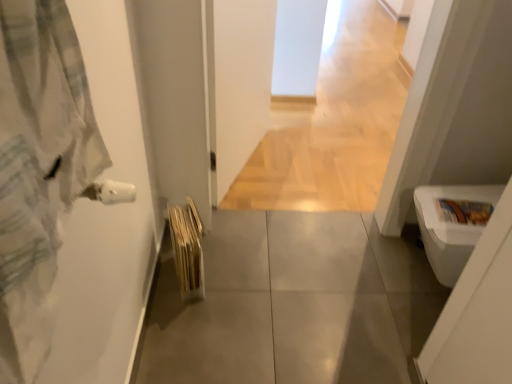
Image resolution: width=512 pixels, height=384 pixels. What do you see at coordinates (451, 226) in the screenshot?
I see `white glossy toilet bowl at lower right` at bounding box center [451, 226].

This screenshot has height=384, width=512. In order to click on light gray flannel bathrobe at left in this screenshot , I will do `click(38, 169)`.

Who is taller, light gray flannel bathrobe at left or white glossy toilet bowl at lower right?

With more height is white glossy toilet bowl at lower right.

How much distance is there between light gray flannel bathrobe at left and white glossy toilet bowl at lower right?

light gray flannel bathrobe at left and white glossy toilet bowl at lower right are 4.13 feet apart.

Between light gray flannel bathrobe at left and white glossy toilet bowl at lower right, which one has smaller width?

Thinner between the two is light gray flannel bathrobe at left.

From a real-world perspective, which is physically above, light gray flannel bathrobe at left or white glossy toilet bowl at lower right?

In real-world perspective, light gray flannel bathrobe at left is above.

Is light gray flannel bathrobe at left looking in the opposite direction of gray tile floor at center?

That's not correct — light gray flannel bathrobe at left is not looking away from gray tile floor at center.

Considering their positions, is light gray flannel bathrobe at left located in front of or behind gray tile floor at center?

Clearly, light gray flannel bathrobe at left is in front of gray tile floor at center.

Considering the positions of objects light gray flannel bathrobe at left and gray tile floor at center in the image provided, who is more to the right, light gray flannel bathrobe at left or gray tile floor at center?

gray tile floor at center is more to the right.

In the scene shown: From the image's perspective, is light gray flannel bathrobe at left positioned above or below gray tile floor at center?

light gray flannel bathrobe at left is situated higher than gray tile floor at center in the image.

Is light gray flannel bathrobe at left far from light wood floor at center?

Yes, light gray flannel bathrobe at left and light wood floor at center are located far from each other.

From a real-world perspective, which is physically above, light gray flannel bathrobe at left or light wood floor at center?

light gray flannel bathrobe at left, from a real-world perspective.

In order to click on bathrobe located in front of the light wood floor at center in this screenshot , I will do `click(38, 169)`.

From the image's perspective, which one is positioned lower, white glossy toilet bowl at lower right or gray tile floor at center?

gray tile floor at center, from the image's perspective.

Who is smaller, white glossy toilet bowl at lower right or gray tile floor at center?

gray tile floor at center.

Is the position of white glossy toilet bowl at lower right more distant than that of gray tile floor at center?

No, white glossy toilet bowl at lower right is in front of gray tile floor at center.

Is light gray flannel bathrobe at left looking in the opposite direction of beige textured bath towel at lower left?

light gray flannel bathrobe at left does not have its back to beige textured bath towel at lower left.

From a real-world perspective, which object rests below the other?

From a 3D spatial view, beige textured bath towel at lower left is below.

Would you say light gray flannel bathrobe at left is outside beige textured bath towel at lower left?

light gray flannel bathrobe at left lies outside beige textured bath towel at lower left's area.

In the image, is beige textured bath towel at lower left positioned in front of or behind white glossy toilet bowl at lower right?

beige textured bath towel at lower left is behind white glossy toilet bowl at lower right.

Is beige textured bath towel at lower left aimed at white glossy toilet bowl at lower right?

Yes, beige textured bath towel at lower left is facing white glossy toilet bowl at lower right.

Which is behind, point (170, 231) or point (434, 201)?

The point (170, 231) is behind.

Looking at this image, is white glossy toilet bowl at lower right a part of beige textured bath towel at lower left?

No, white glossy toilet bowl at lower right is not surrounded by beige textured bath towel at lower left.

Based on the photo, is light wood floor at center taller than beige textured bath towel at lower left?

Incorrect, the height of light wood floor at center is not larger of that of beige textured bath towel at lower left.

From a real-world perspective, between light wood floor at center and beige textured bath towel at lower left, who is vertically higher?

From a 3D spatial view, beige textured bath towel at lower left is above.

Which is behind, light wood floor at center or beige textured bath towel at lower left?

Positioned behind is light wood floor at center.

From the picture: Does light wood floor at center turn towards beige textured bath towel at lower left?

No, light wood floor at center does not turn towards beige textured bath towel at lower left.

Find the location of a particular element. The image size is (512, 384). toilet bowl on the right of light gray flannel bathrobe at left is located at coordinates (451, 226).

What are the coordinates of `bathrobe above the gray tile floor at center (from a real-world perspective)` in the screenshot? It's located at (38, 169).

Which object lies further to the anchor point light wood floor at center, white glossy toilet bowl at lower right or beige textured bath towel at lower left?

beige textured bath towel at lower left lies further to light wood floor at center than the other object.

Considering their positions, is light wood floor at center positioned further to light gray flannel bathrobe at left than gray tile floor at center?

Among the two, light wood floor at center is located further to light gray flannel bathrobe at left.

Which object lies nearer to the anchor point gray tile floor at center, light wood floor at center or beige textured bath towel at lower left?

beige textured bath towel at lower left lies closer to gray tile floor at center than the other object.

Which object lies nearer to the anchor point light wood floor at center, white glossy toilet bowl at lower right or gray tile floor at center?

gray tile floor at center lies closer to light wood floor at center than the other object.

When comparing their distances from gray tile floor at center, does beige textured bath towel at lower left or white glossy toilet bowl at lower right seem closer?

Among the two, beige textured bath towel at lower left is located nearer to gray tile floor at center.

Which object lies further to the anchor point light gray flannel bathrobe at left, beige textured bath towel at lower left or light wood floor at center?

Among the two, light wood floor at center is located further to light gray flannel bathrobe at left.

Looking at this image, from the image, which object appears to be farther from light gray flannel bathrobe at left, gray tile floor at center or light wood floor at center?

light wood floor at center is positioned further to the anchor light gray flannel bathrobe at left.

Estimate the real-world distances between objects in this image. Which object is further from white glossy toilet bowl at lower right, light wood floor at center or beige textured bath towel at lower left?

light wood floor at center.

What are the coordinates of `concrete positioned between light gray flannel bathrobe at left and light wood floor at center from near to far` in the screenshot? It's located at (277, 307).

Identify the location of toilet bowl between light gray flannel bathrobe at left and gray tile floor at center along the z-axis. The width and height of the screenshot is (512, 384). (451, 226).

Locate an element on the screen. The width and height of the screenshot is (512, 384). bath towel located between light gray flannel bathrobe at left and light wood floor at center in the depth direction is located at coordinates (187, 250).

I want to click on toilet bowl between light wood floor at center and gray tile floor at center in the vertical direction, so click(x=451, y=226).